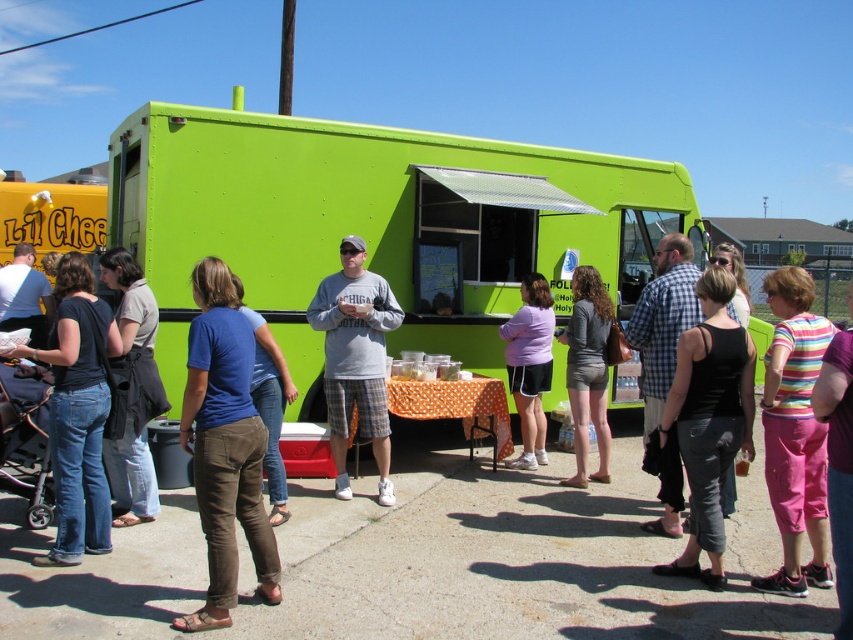
Question: Can you confirm if green matte food truck at center is positioned below gray cotton shirt at center?

Choices:
 (A) yes
 (B) no

Answer: (B)

Question: Among these objects, which one is nearest to the camera?

Choices:
 (A) striped fabric shirt at center
 (B) denim jeans at left

Answer: (A)

Question: Does striped fabric shirt at center have a smaller size compared to gray cotton shirt at center?

Choices:
 (A) no
 (B) yes

Answer: (B)

Question: Which of the following is the farthest from the observer?

Choices:
 (A) (316, 296)
 (B) (107, 336)

Answer: (A)

Question: Can you confirm if green matte food truck at center is positioned above denim jeans at left?

Choices:
 (A) yes
 (B) no

Answer: (A)

Question: Which object is positioned farthest from the matte purple shirt at center?

Choices:
 (A) denim jeans at left
 (B) green matte food truck at center

Answer: (A)